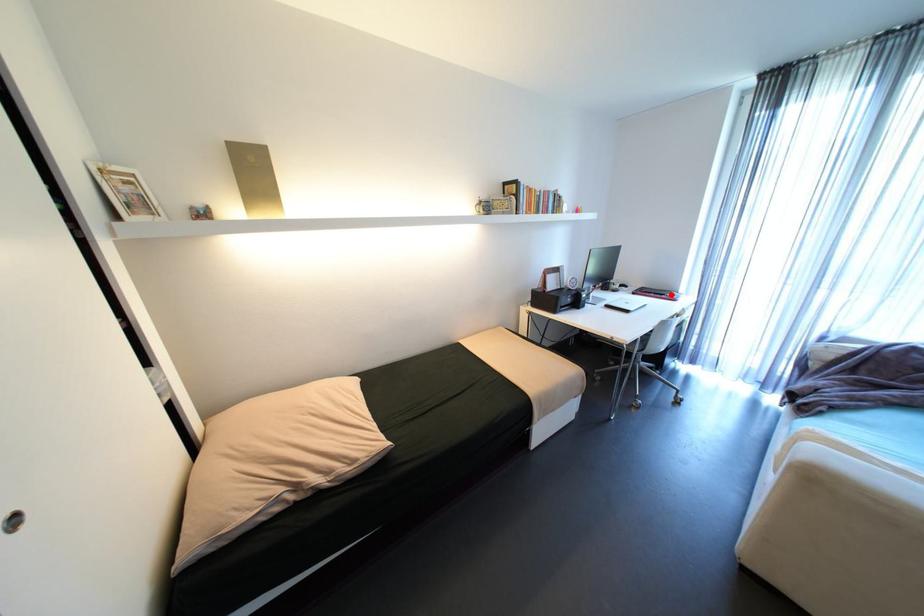
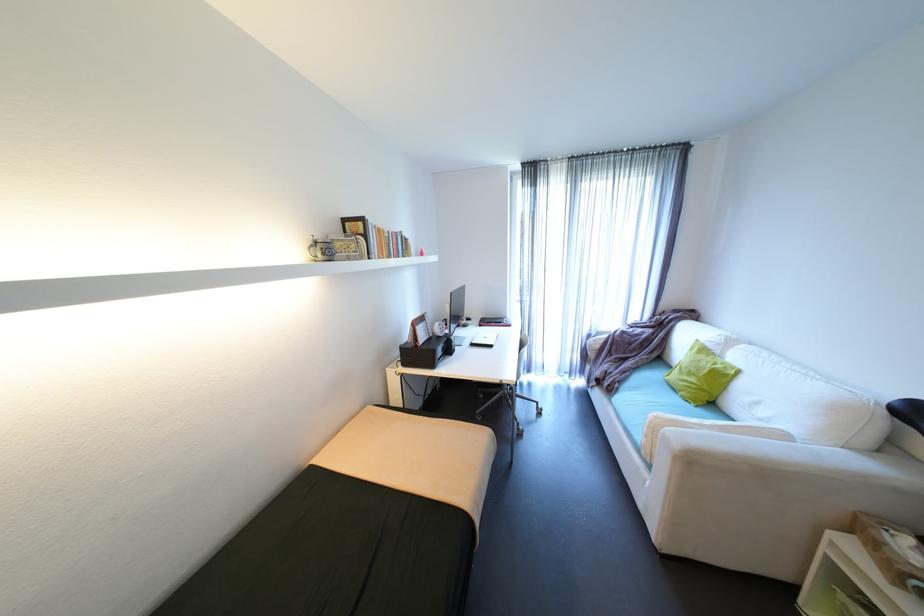
Find the pixel in the second image that matches the highlighted location in the first image.

(508, 323)